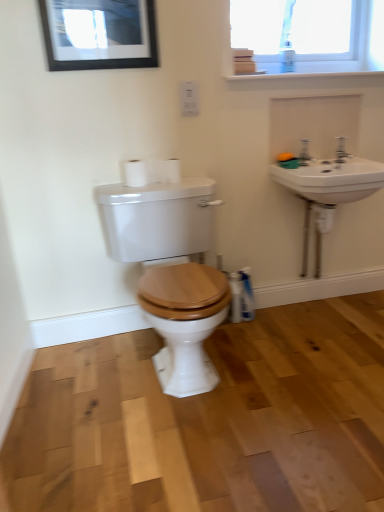
I want to click on vacant area situated to the left side of wooden toilet seat at center, so click(x=72, y=389).